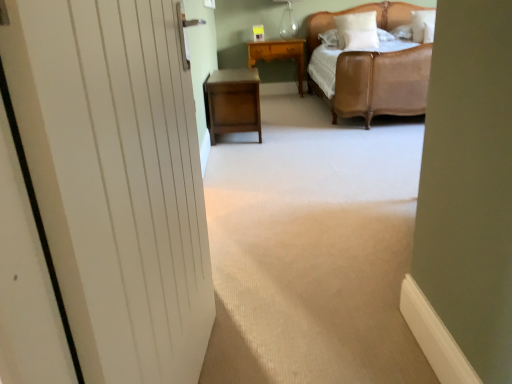
You are a GUI agent. You are given a task and a screenshot of the screen. Output one action in this format:
    pyautogui.click(x=<x>, y=<y>)
    Task: Click on the transparent glass table lamp at upper center
    
    Given the screenshot: What is the action you would take?
    pyautogui.click(x=288, y=20)

Measure the distance between point (234,76) and camera.

Point (234,76) is 11.53 feet away from camera.

The image size is (512, 384). Identify the location of wooden nightstand at center, the 2th nightstand positioned from the top. (233, 102).

In order to face white matte door at left, should I rotate leftwards or rightwards?

Turn left by 13.508 degrees to look at white matte door at left.

Describe the element at coordinates (357, 30) in the screenshot. I see `white soft pillow at upper right, positioned as the third pillow in right-to-left order` at that location.

The height and width of the screenshot is (384, 512). What do you see at coordinates (360, 39) in the screenshot? I see `white soft pillow at upper center, which ranks as the second pillow in right-to-left order` at bounding box center [360, 39].

At what (x,y) coordinates should I click in order to perform the action: click on transparent glass table lamp at upper center. Please return your answer as a coordinate pair (x, y). This screenshot has width=512, height=384. Looking at the image, I should click on (288, 20).

Measure the distance from white matte door at left to white soft pillow at upper right, positioned as the third pillow in right-to-left order.

They are 12.15 feet apart.

Image resolution: width=512 pixels, height=384 pixels. I want to click on door in front of the white soft pillow at upper right, positioned as the third pillow in right-to-left order, so click(116, 179).

Which of these two, white matte door at left or white soft pillow at upper right, marked as the 1th pillow in a left-to-right arrangement, stands shorter?

With less height is white soft pillow at upper right, marked as the 1th pillow in a left-to-right arrangement.

Looking at this image, is white matte door at left thinner than white soft pillow at upper right, positioned as the third pillow in right-to-left order?

Indeed, white matte door at left has a lesser width compared to white soft pillow at upper right, positioned as the third pillow in right-to-left order.

Who is smaller, yellow wood nightstand at center, positioned as the 2th nightstand in bottom-to-top order, or wooden nightstand at center, the 2th nightstand positioned from the top?

Smaller between the two is yellow wood nightstand at center, positioned as the 2th nightstand in bottom-to-top order.

Which is in front, yellow wood nightstand at center, positioned as the 2th nightstand in bottom-to-top order, or wooden nightstand at center, arranged as the second nightstand when viewed from the back?

wooden nightstand at center, arranged as the second nightstand when viewed from the back, is in front.

Measure the distance between yellow wood nightstand at center, the 1th nightstand positioned from the top, and wooden nightstand at center, the 2th nightstand positioned from the top.

yellow wood nightstand at center, the 1th nightstand positioned from the top, and wooden nightstand at center, the 2th nightstand positioned from the top, are 1.90 meters apart from each other.

Does yellow wood nightstand at center, positioned as the 2th nightstand in bottom-to-top order, have a lesser width compared to wooden nightstand at center, arranged as the second nightstand when viewed from the back?

Correct, the width of yellow wood nightstand at center, positioned as the 2th nightstand in bottom-to-top order, is less than that of wooden nightstand at center, arranged as the second nightstand when viewed from the back.

From a real-world perspective, between white wood door at left and white soft pillow at upper center, which ranks as the second pillow in right-to-left order, who is vertically higher?

white soft pillow at upper center, which ranks as the second pillow in right-to-left order, is physically above.

Is white wood door at left to the left or to the right of white soft pillow at upper center, which ranks as the second pillow in right-to-left order, in the image?

white wood door at left is to the left of white soft pillow at upper center, which ranks as the second pillow in right-to-left order.

Looking at this image, considering the sizes of white wood door at left and white soft pillow at upper center, which ranks as the second pillow in right-to-left order, in the image, is white wood door at left taller or shorter than white soft pillow at upper center, which ranks as the second pillow in right-to-left order,?

In the image, white wood door at left appears to be shorter than white soft pillow at upper center, which ranks as the second pillow in right-to-left order.

Is white soft pillow at upper right, the third pillow from the left, not inside white soft pillow at upper right, positioned as the third pillow in right-to-left order?

Yes.

From the image's perspective, is white soft pillow at upper right, which is the first pillow in right-to-left order, above or below white soft pillow at upper right, marked as the 1th pillow in a left-to-right arrangement?

Clearly, from the image's perspective, white soft pillow at upper right, which is the first pillow in right-to-left order, is above white soft pillow at upper right, marked as the 1th pillow in a left-to-right arrangement.

Considering the positions of objects white soft pillow at upper right, the third pillow from the left, and white soft pillow at upper right, positioned as the third pillow in right-to-left order, in the image provided, who is more to the left, white soft pillow at upper right, the third pillow from the left, or white soft pillow at upper right, positioned as the third pillow in right-to-left order,?

white soft pillow at upper right, positioned as the third pillow in right-to-left order, is more to the left.

Considering the positions of points (420, 33) and (348, 25), is point (420, 33) closer to camera compared to point (348, 25)?

Yes, it is.

Is white soft pillow at upper center, which ranks as the second pillow in right-to-left order, taller than transparent glass table lamp at upper center?

Incorrect, the height of white soft pillow at upper center, which ranks as the second pillow in right-to-left order, is not larger of that of transparent glass table lamp at upper center.

Between white soft pillow at upper center, which ranks as the second pillow in right-to-left order, and transparent glass table lamp at upper center, which one appears on the right side from the viewer's perspective?

From the viewer's perspective, white soft pillow at upper center, which ranks as the second pillow in right-to-left order, appears more on the right side.

Between white soft pillow at upper center, which ranks as the second pillow in right-to-left order, and transparent glass table lamp at upper center, which one has smaller size?

With smaller size is white soft pillow at upper center, which ranks as the second pillow in right-to-left order.

Is white soft pillow at upper center, which ranks as the second pillow in right-to-left order, located outside transparent glass table lamp at upper center?

white soft pillow at upper center, which ranks as the second pillow in right-to-left order, is positioned outside transparent glass table lamp at upper center.

Where is `nightstand that is the 1st object located below the white soft pillow at upper center, marked as the second pillow in a left-to-right arrangement (from the image's perspective)`? nightstand that is the 1st object located below the white soft pillow at upper center, marked as the second pillow in a left-to-right arrangement (from the image's perspective) is located at coordinates (279, 54).

Who is taller, yellow wood nightstand at center, arranged as the first nightstand when viewed from the back, or white soft pillow at upper center, which ranks as the second pillow in right-to-left order?

With more height is yellow wood nightstand at center, arranged as the first nightstand when viewed from the back.

From the image's perspective, does yellow wood nightstand at center, arranged as the first nightstand when viewed from the back, appear higher than white soft pillow at upper center, marked as the second pillow in a left-to-right arrangement?

No, from the image's perspective, yellow wood nightstand at center, arranged as the first nightstand when viewed from the back, is not over white soft pillow at upper center, marked as the second pillow in a left-to-right arrangement.

From the image's perspective, is white soft pillow at upper right, marked as the 1th pillow in a left-to-right arrangement, located above or below white soft pillow at upper right, which is the first pillow in right-to-left order?

Clearly, from the image's perspective, white soft pillow at upper right, marked as the 1th pillow in a left-to-right arrangement, is below white soft pillow at upper right, which is the first pillow in right-to-left order.

Considering the positions of objects white soft pillow at upper right, positioned as the third pillow in right-to-left order, and white soft pillow at upper right, the third pillow from the left, in the image provided, who is behind, white soft pillow at upper right, positioned as the third pillow in right-to-left order, or white soft pillow at upper right, the third pillow from the left,?

white soft pillow at upper right, positioned as the third pillow in right-to-left order, is further away from the camera.

Looking at this image, does white soft pillow at upper right, marked as the 1th pillow in a left-to-right arrangement, touch white soft pillow at upper right, which is the first pillow in right-to-left order?

No, white soft pillow at upper right, marked as the 1th pillow in a left-to-right arrangement, is not next to white soft pillow at upper right, which is the first pillow in right-to-left order.

Is white soft pillow at upper right, marked as the 1th pillow in a left-to-right arrangement, not within white soft pillow at upper right, the third pillow from the left?

Yes, white soft pillow at upper right, marked as the 1th pillow in a left-to-right arrangement, is not within white soft pillow at upper right, the third pillow from the left.

This screenshot has height=384, width=512. In order to click on the 3rd pillow directly above the white matte door at left (from a real-world perspective) in this screenshot , I will do `click(357, 30)`.

Where is `nightstand on the left of yellow wood nightstand at center, positioned as the 2th nightstand in bottom-to-top order`? This screenshot has width=512, height=384. nightstand on the left of yellow wood nightstand at center, positioned as the 2th nightstand in bottom-to-top order is located at coordinates (233, 102).

Considering their positions, is transparent glass table lamp at upper center positioned closer to white wood door at left than wooden nightstand at center, the 2th nightstand positioned from the top?

Among the two, wooden nightstand at center, the 2th nightstand positioned from the top, is located nearer to white wood door at left.

Which object lies further to the anchor point white wood door at left, white soft pillow at upper right, positioned as the third pillow in right-to-left order, or white soft pillow at upper right, the third pillow from the left?

white soft pillow at upper right, the third pillow from the left, is further to white wood door at left.

Based on their spatial positions, is white soft pillow at upper center, which ranks as the second pillow in right-to-left order, or transparent glass table lamp at upper center closer to white soft pillow at upper right, the third pillow from the left?

white soft pillow at upper center, which ranks as the second pillow in right-to-left order, lies closer to white soft pillow at upper right, the third pillow from the left, than the other object.

Estimate the real-world distances between objects in this image. Which object is further from white wood door at left, wooden nightstand at center, the 2th nightstand positioned from the top, or white soft pillow at upper right, positioned as the third pillow in right-to-left order?

The object further to white wood door at left is white soft pillow at upper right, positioned as the third pillow in right-to-left order.

From the picture: From the image, which object appears to be nearer to white soft pillow at upper center, which ranks as the second pillow in right-to-left order, leather bed at upper right or white soft pillow at upper right, which is the first pillow in right-to-left order?

Among the two, white soft pillow at upper right, which is the first pillow in right-to-left order, is located nearer to white soft pillow at upper center, which ranks as the second pillow in right-to-left order.

From the image, which object appears to be farther from white soft pillow at upper right, marked as the 1th pillow in a left-to-right arrangement, wooden nightstand at center, the first nightstand in the front-to-back sequence, or yellow wood nightstand at center, which ranks as the second nightstand in front-to-back order?

Among the two, wooden nightstand at center, the first nightstand in the front-to-back sequence, is located further to white soft pillow at upper right, marked as the 1th pillow in a left-to-right arrangement.

Which object lies further to the anchor point yellow wood nightstand at center, arranged as the first nightstand when viewed from the back, wooden nightstand at center, the first nightstand in the front-to-back sequence, or white wood door at left?

Based on the image, white wood door at left appears to be further to yellow wood nightstand at center, arranged as the first nightstand when viewed from the back.

Looking at the image, which one is located closer to leather bed at upper right, white soft pillow at upper center, which ranks as the second pillow in right-to-left order, or white wood door at left?

white soft pillow at upper center, which ranks as the second pillow in right-to-left order, lies closer to leather bed at upper right than the other object.

You are a GUI agent. You are given a task and a screenshot of the screen. Output one action in this format:
    pyautogui.click(x=<x>, y=<y>)
    Task: Click on the bed situated between wooden nightstand at center, positioned as the first nightstand in bottom-to-top order, and white soft pillow at upper right, which is the first pillow in right-to-left order, from left to right
    This screenshot has width=512, height=384.
    Given the screenshot: What is the action you would take?
    pyautogui.click(x=381, y=83)

Locate an element on the screen. This screenshot has width=512, height=384. pillow between white wood door at left and white soft pillow at upper right, the third pillow from the left, along the z-axis is located at coordinates (360, 39).

This screenshot has height=384, width=512. What are the coordinates of `nightstand between white matte door at left and white soft pillow at upper center, marked as the second pillow in a left-to-right arrangement, along the z-axis` in the screenshot? It's located at (233, 102).

This screenshot has width=512, height=384. What are the coordinates of `nightstand positioned between white matte door at left and yellow wood nightstand at center, the 1th nightstand positioned from the top, from near to far` in the screenshot? It's located at 233,102.